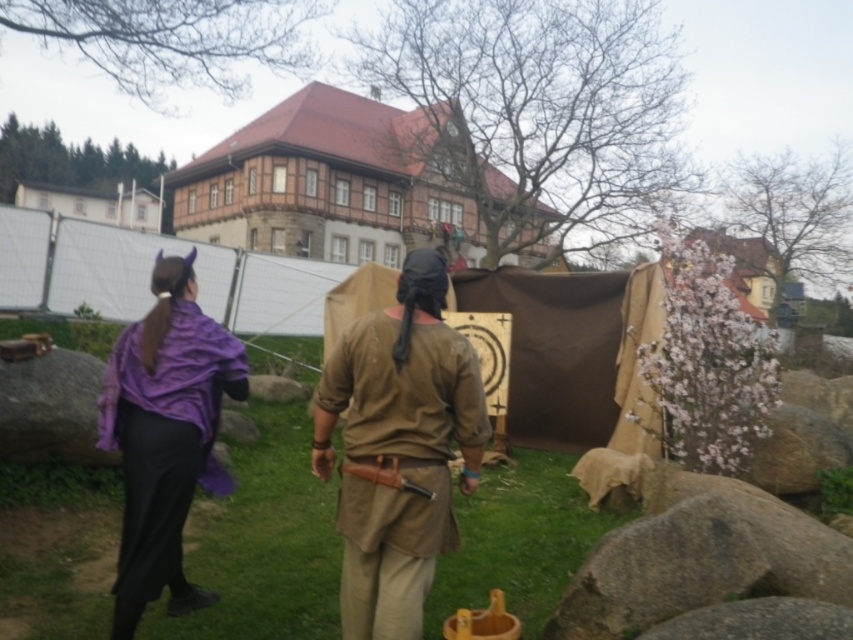
Is brown leather apron at center bigger than purple matte robe at left?

Actually, brown leather apron at center might be smaller than purple matte robe at left.

What do you see at coordinates (398, 448) in the screenshot? I see `brown leather apron at center` at bounding box center [398, 448].

Find the location of a particular element. brown leather apron at center is located at coordinates (398, 448).